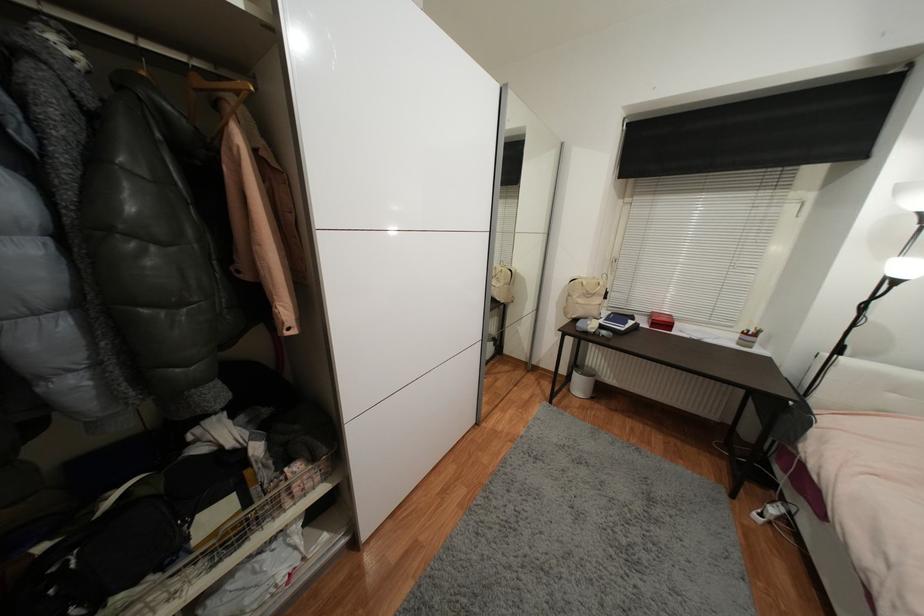
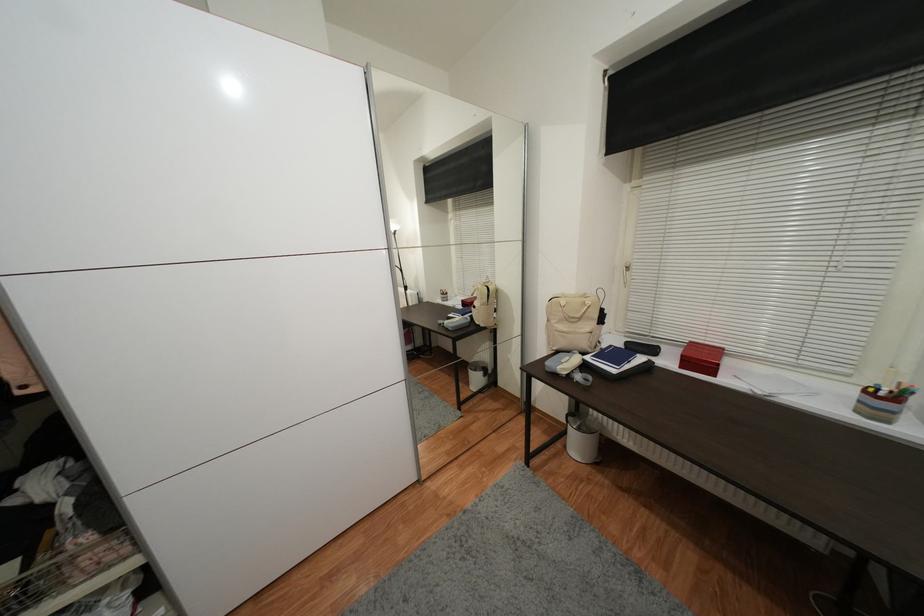
The images are taken continuously from a first-person perspective. In which direction are you moving?

The cameraman moved toward right, forward.